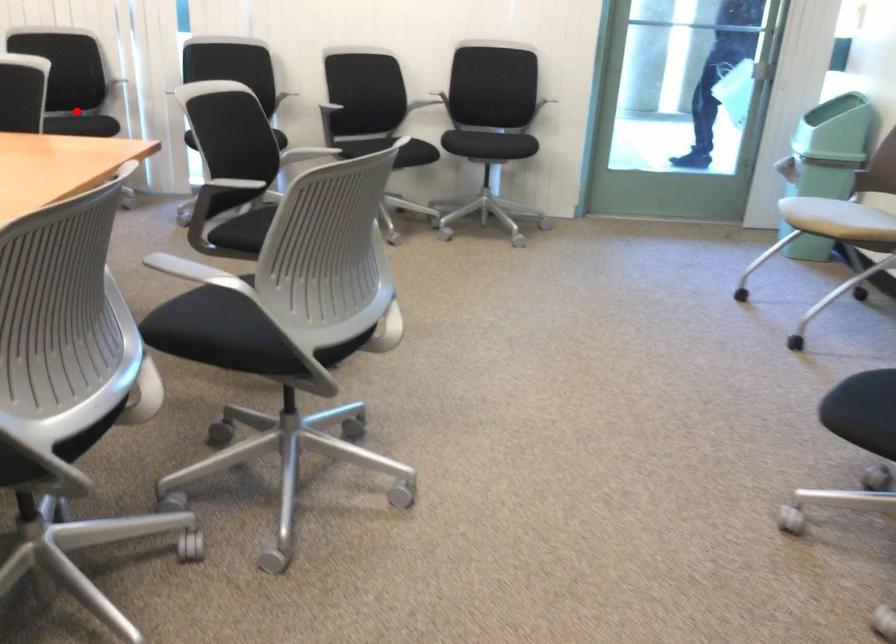
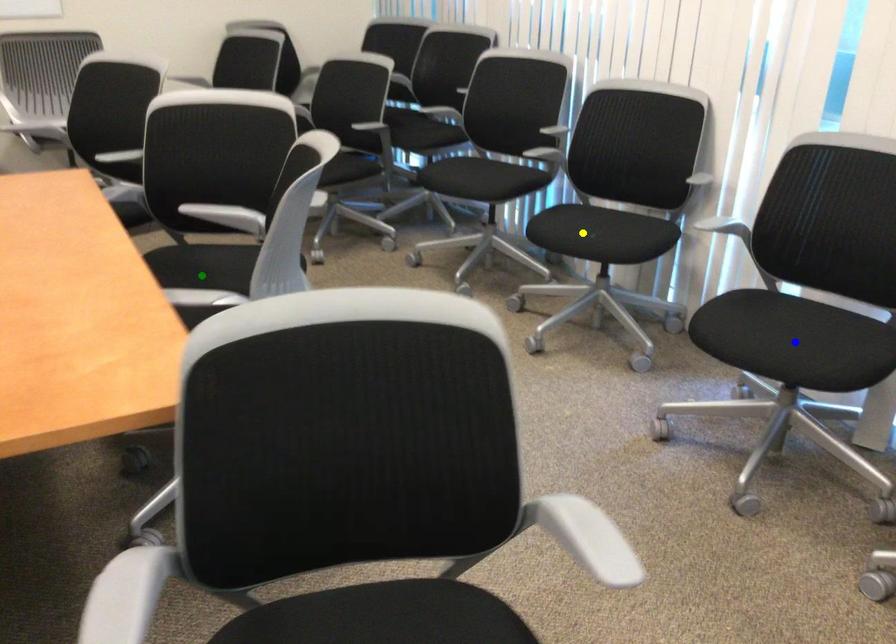
Question: I am providing you with two images of the same scene from different viewpoints. A red point is marked on the first image. You are given multiple points on the second image. Can you choose the point in image 2 that corresponds to the point in image 1?

Choices:
 (A) blue point
 (B) green point
 (C) yellow point

Answer: (C)